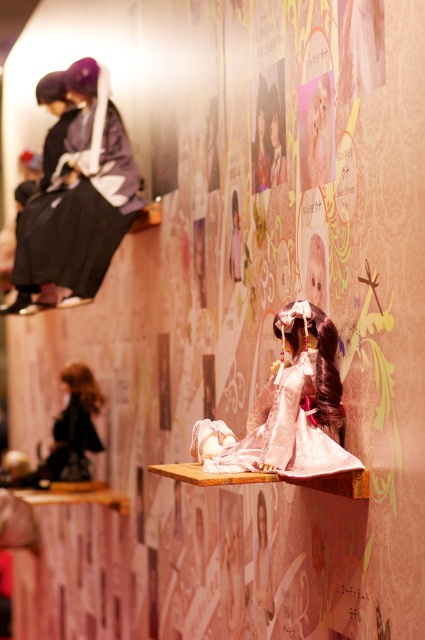
You are a photographer setting up a shot of the display setup. You have two points marked on your viewfinder at coordinates point [96,156] and point [302,397]. Which point is closer to your camera?

Point [96,156] is further to the camera than point [302,397], so the closer point to the camera is point [302,397].